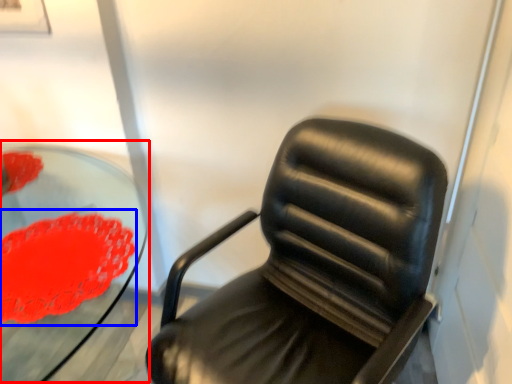
Question: Among these objects, which one is nearest to the camera, round table (highlighted by a red box) or flower (highlighted by a blue box)?

Choices:
 (A) round table
 (B) flower

Answer: (A)